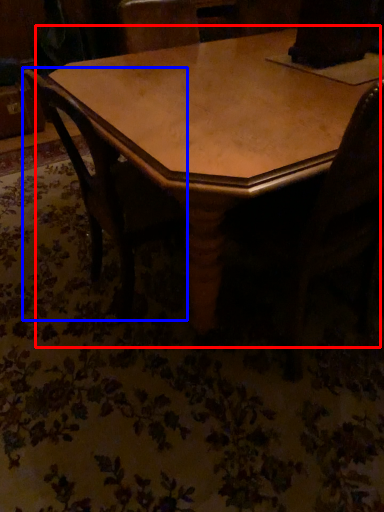
Question: Which object appears closest to the camera in this image, table (highlighted by a red box) or chair (highlighted by a blue box)?

Choices:
 (A) table
 (B) chair

Answer: (A)